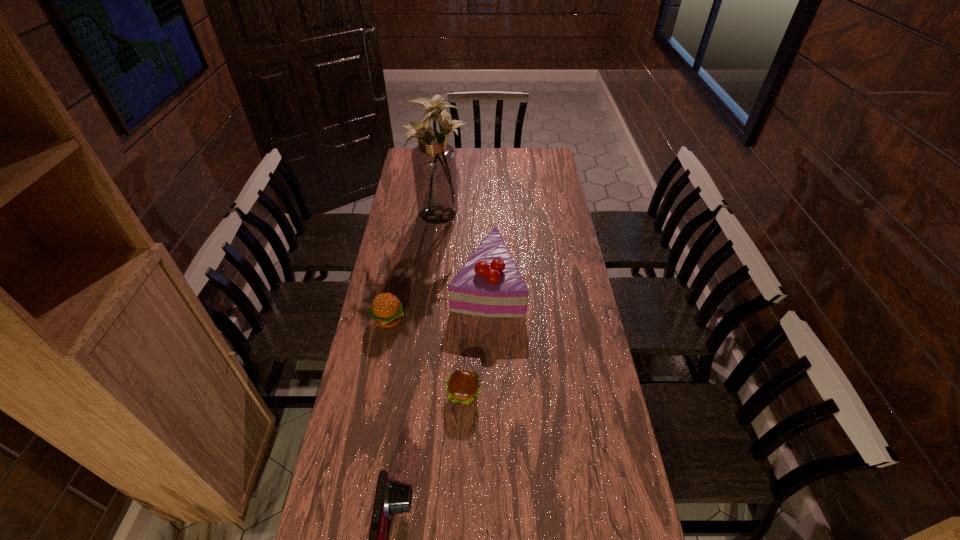
Identify the location of free space between the taller hamburger and the tallest object. (415, 266).

You are a GUI agent. You are given a task and a screenshot of the screen. Output one action in this format:
    pyautogui.click(x=<x>, y=<y>)
    Task: Click on the vacant area that lies between the farther hamburger and the tallest object
    
    Given the screenshot: What is the action you would take?
    415,266

Select which object appears as the second closest to the tallest object. Please provide its 2D coordinates. Your answer should be formatted as a tuple, i.e. [(x, y)], where the tuple contains the x and y coordinates of a point satisfying the conditions above.

[(387, 310)]

Where is `the third closest object to the fourth shortest object`? The image size is (960, 540). the third closest object to the fourth shortest object is located at coordinates (462, 386).

Identify the location of free spot that satisfies the following two spatial constraints: 1. on the back side of the left hamburger; 2. on the left side of the farthest object. This screenshot has width=960, height=540. (409, 212).